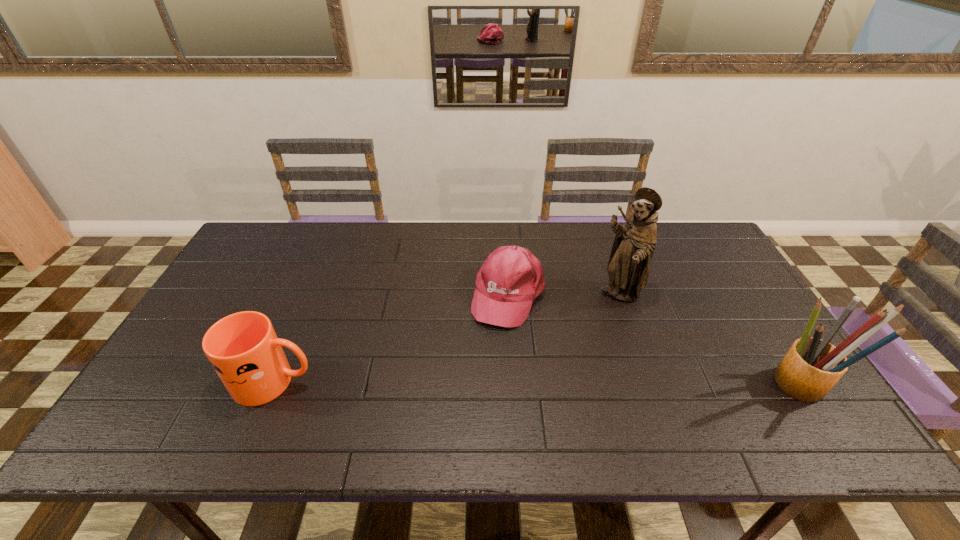
You are a GUI agent. You are given a task and a screenshot of the screen. Output one action in this format:
    pyautogui.click(x=<x>, y=<y>)
    Task: Click on the vacant space that satisfies the following two spatial constraints: 1. on the front side of the rightmost object; 2. on the left side of the baseball cap
    
    Given the screenshot: What is the action you would take?
    pyautogui.click(x=515, y=384)